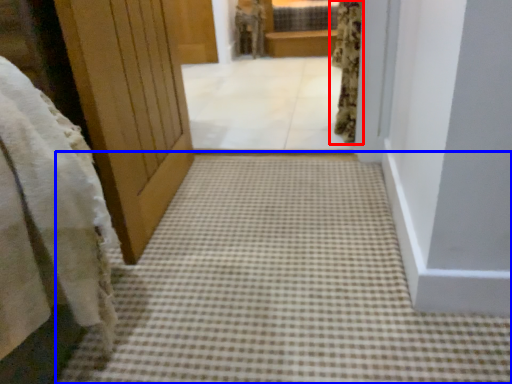
Question: Which object appears farthest to the camera in this image, curtain (highlighted by a red box) or path (highlighted by a blue box)?

Choices:
 (A) curtain
 (B) path

Answer: (A)